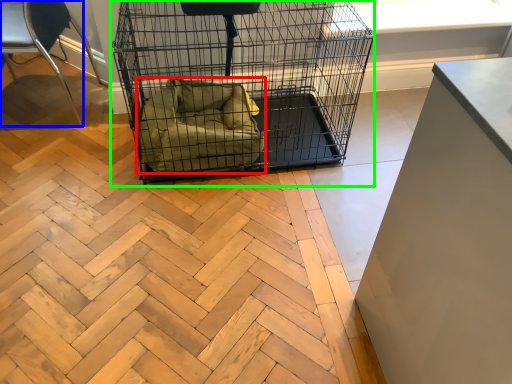
Question: Which is nearer to the dog bed (highlighted by a red box)? chair (highlighted by a blue box) or bird cage (highlighted by a green box).

Choices:
 (A) chair
 (B) bird cage

Answer: (B)